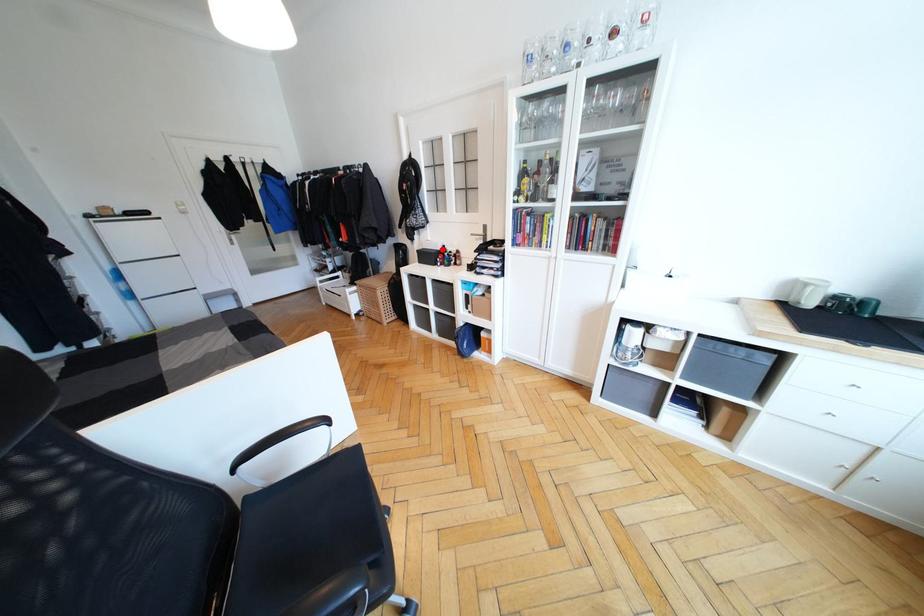
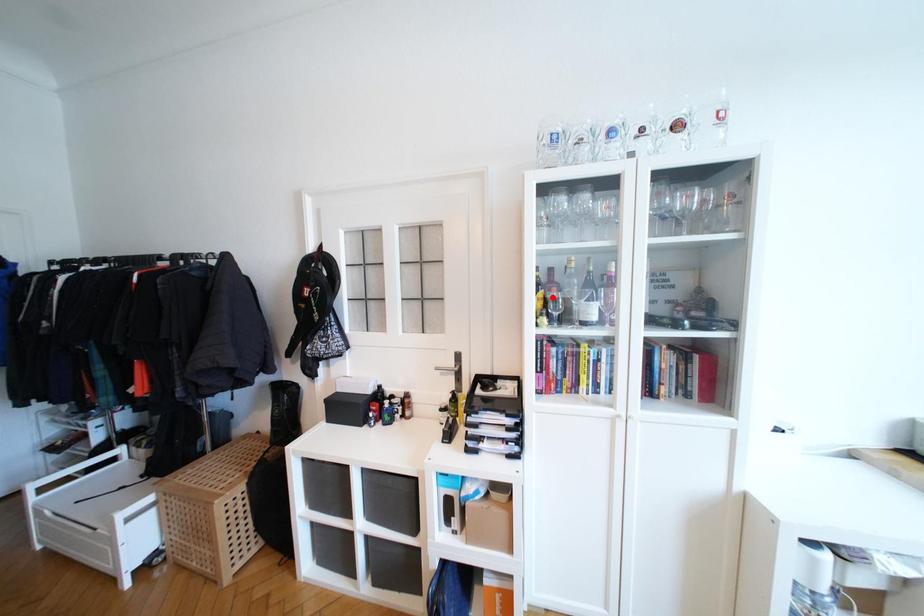
I am providing you with two images of the same scene from different viewpoints. A red point is marked on the first image and another point is marked on the second image. Are the points marked in image1 and image2 representing the same 3D position?

No